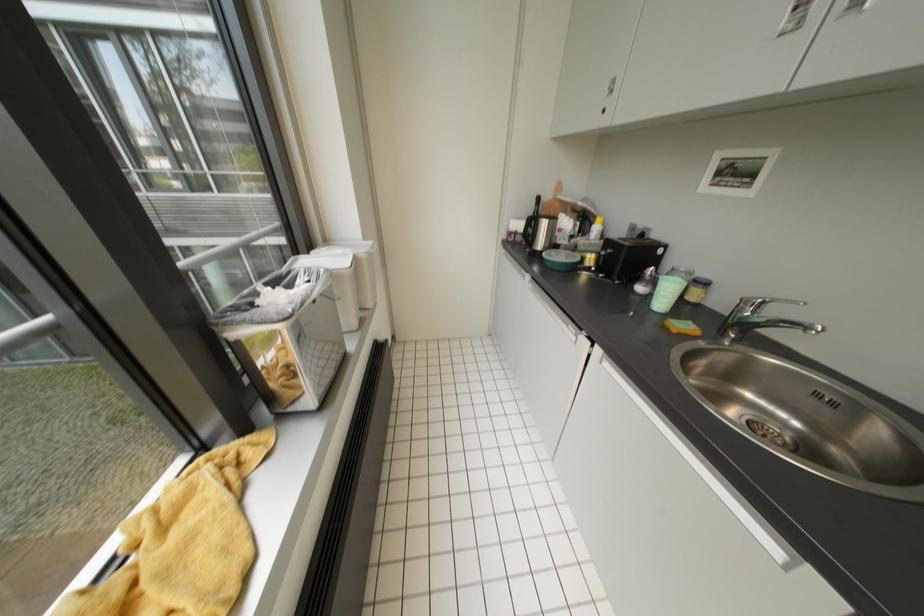
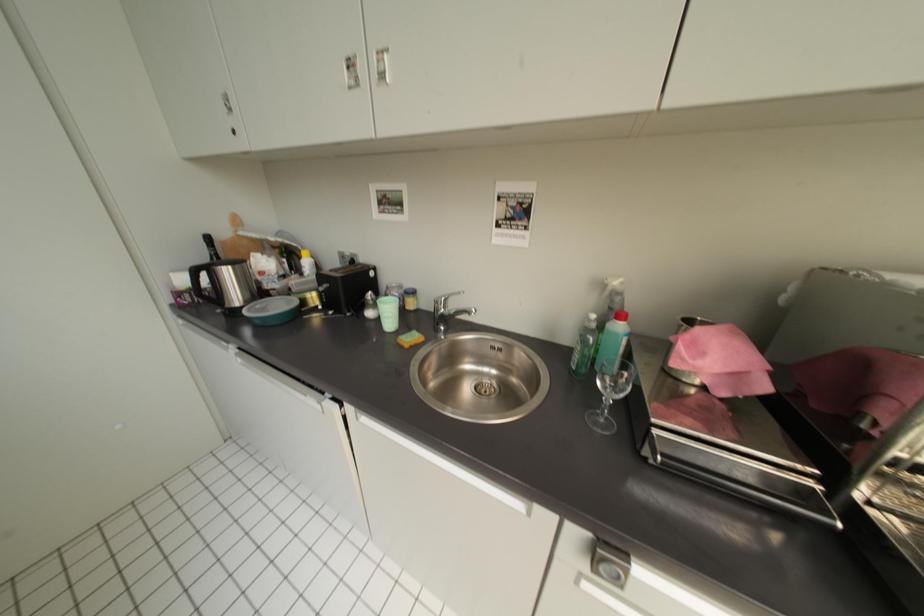
Question: The camera is either moving clockwise (left) or counter-clockwise (right) around the object. The first image is from the beginning of the video and the second image is from the end. Is the camera moving left or right when shooting the video?

Choices:
 (A) Left
 (B) Right

Answer: (A)